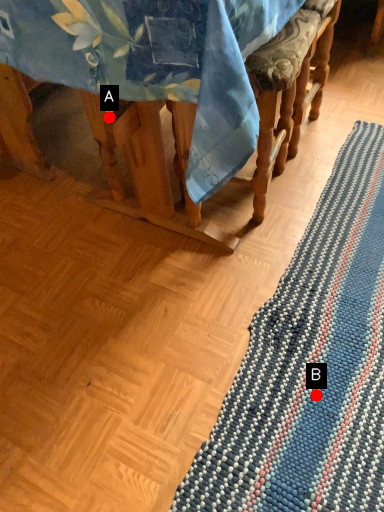
Question: Two points are circled on the image, labeled by A and B beside each circle. Which point is closer to the camera?

Choices:
 (A) A is closer
 (B) B is closer

Answer: (B)